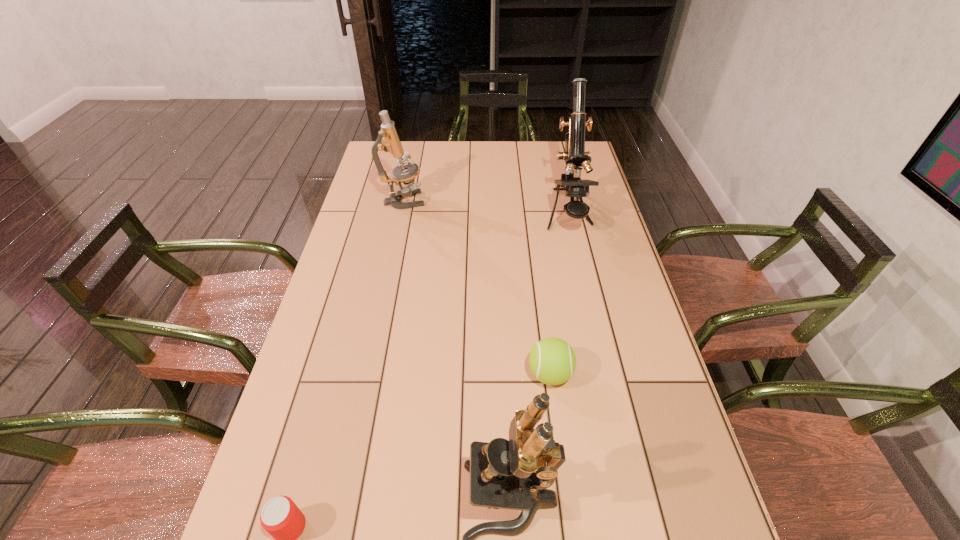
The height and width of the screenshot is (540, 960). Identify the location of free space at the far edge. (417, 145).

Where is `free space at the left edge of the desktop`? free space at the left edge of the desktop is located at coordinates (355, 335).

In the image, there is a desktop. Where is `vacant area at the far right corner`? This screenshot has width=960, height=540. vacant area at the far right corner is located at coordinates (564, 170).

Where is `vacant region between the tallest object and the fourth tallest object`? Image resolution: width=960 pixels, height=540 pixels. vacant region between the tallest object and the fourth tallest object is located at coordinates (559, 295).

Find the location of a particular element. This screenshot has width=960, height=540. vacant space that is in between the fourth tallest object and the tallest microscope is located at coordinates (559, 295).

Locate an element on the screen. This screenshot has width=960, height=540. free space between the leftmost microscope and the tallest microscope is located at coordinates (486, 208).

Locate an element on the screen. This screenshot has width=960, height=540. vacant area that lies between the leftmost microscope and the tennis ball is located at coordinates 476,288.

Identify the location of object that is the second closest to the second shortest object. (575, 156).

Locate an element on the screen. Image resolution: width=960 pixels, height=540 pixels. the closest object to the third nearest object is located at coordinates (514, 474).

Select which microscope is the second closest to the tallest microscope. Please provide its 2D coordinates. Your answer should be formatted as a tuple, i.e. [(x, y)], where the tuple contains the x and y coordinates of a point satisfying the conditions above.

[(514, 474)]